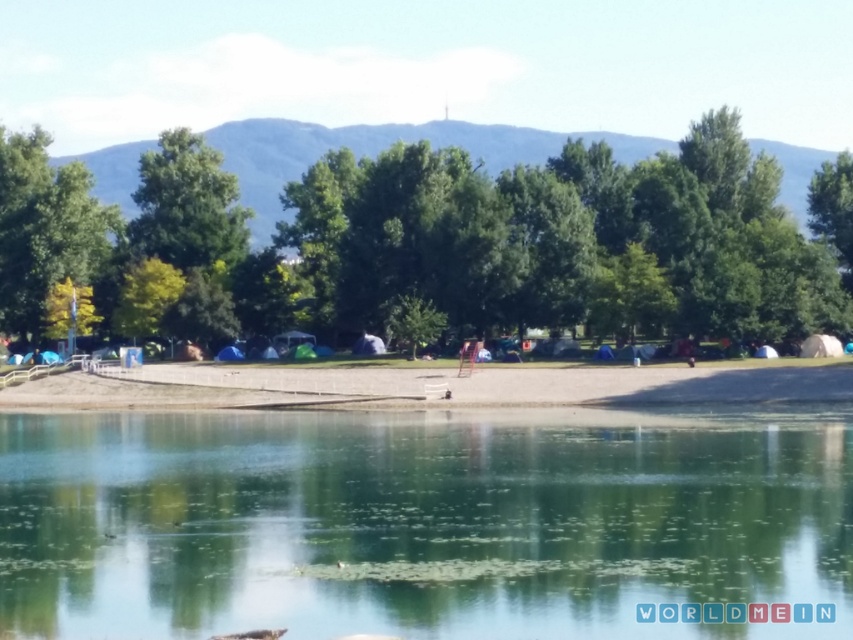
Looking at this image, you are standing at the coordinates 0.7, 0.5 in the image. Which direction should you move to reach the clear water at center?

The clear water at center is located at coordinates (415,524). Since you are at (426,448), you should move northeast to reach it.

You are standing at the edge of the lake and want to reach the green leafy tree at center. According to the coordinates provided, in which direction should you walk from your current position to reach the tree?

The green leafy tree at center is located at coordinates point (x=442, y=241). Since you are at the edge of the lake, which is the lower part of the image, you should walk towards the upper part of the image to reach the tree.